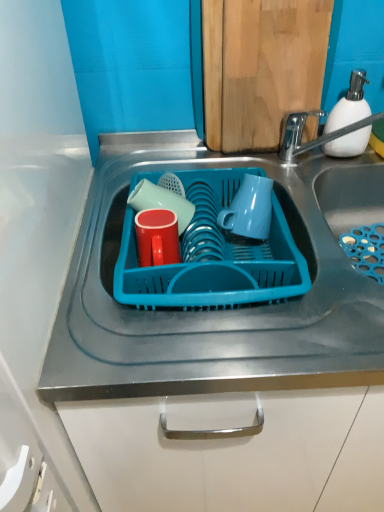
Question: Is blue plastic tray at center looking in the opposite direction of matte red cup at center, the first tableware in the front-to-back sequence?

Choices:
 (A) yes
 (B) no

Answer: (B)

Question: Is blue plastic tray at center oriented towards matte red cup at center, the first tableware in the front-to-back sequence?

Choices:
 (A) yes
 (B) no

Answer: (B)

Question: Is blue plastic tray at center taller than matte red cup at center, the second tableware positioned from the back?

Choices:
 (A) yes
 (B) no

Answer: (A)

Question: From a real-world perspective, is blue plastic tray at center over matte red cup at center, the first tableware in the front-to-back sequence?

Choices:
 (A) no
 (B) yes

Answer: (A)

Question: Can you confirm if blue plastic tray at center is smaller than matte red cup at center, the first tableware in the front-to-back sequence?

Choices:
 (A) yes
 (B) no

Answer: (B)

Question: Is blue plastic tray at center at the right side of matte red cup at center, the first tableware in the front-to-back sequence?

Choices:
 (A) yes
 (B) no

Answer: (A)

Question: Would you consider white matte soap dispenser at upper right to be distant from blue plastic tray at center?

Choices:
 (A) no
 (B) yes

Answer: (A)

Question: Is blue plastic tray at center a part of white matte soap dispenser at upper right?

Choices:
 (A) yes
 (B) no

Answer: (B)

Question: Considering the relative sizes of white matte soap dispenser at upper right and blue plastic tray at center in the image provided, is white matte soap dispenser at upper right smaller than blue plastic tray at center?

Choices:
 (A) yes
 (B) no

Answer: (A)

Question: From the image's perspective, is white matte soap dispenser at upper right located above blue plastic tray at center?

Choices:
 (A) no
 (B) yes

Answer: (B)

Question: From a real-world perspective, is white matte soap dispenser at upper right located beneath blue plastic tray at center?

Choices:
 (A) yes
 (B) no

Answer: (B)

Question: From a real-world perspective, does white matte soap dispenser at upper right stand above blue plastic tray at center?

Choices:
 (A) no
 (B) yes

Answer: (B)

Question: From a real-world perspective, does blue plastic tray at center sit lower than matte red cup at center, the first tableware in the back-to-front sequence?

Choices:
 (A) no
 (B) yes

Answer: (B)